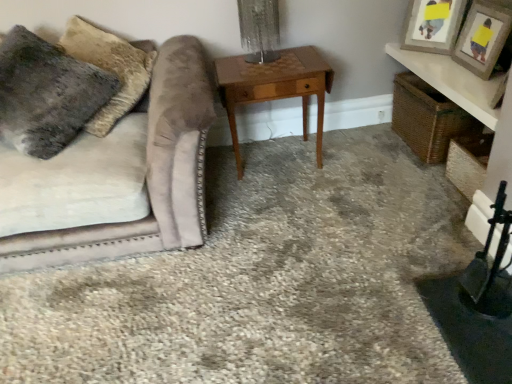
Locate an element on the screen. The image size is (512, 384). free point in front of light brown wood table at center is located at coordinates (286, 207).